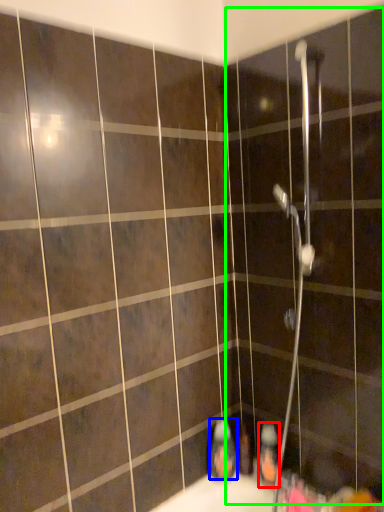
Question: Considering the real-world distances, which object is closest to toiletry (highlighted by a red box)? toiletry (highlighted by a blue box) or screen door (highlighted by a green box).

Choices:
 (A) toiletry
 (B) screen door

Answer: (A)